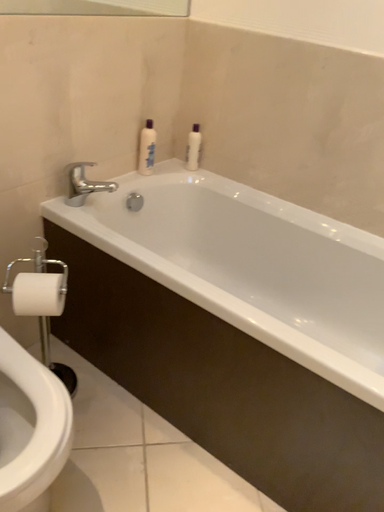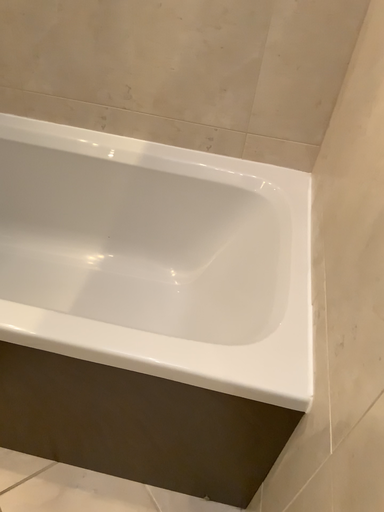
Question: How did the camera likely rotate when shooting the video?

Choices:
 (A) rotated right
 (B) rotated left

Answer: (A)